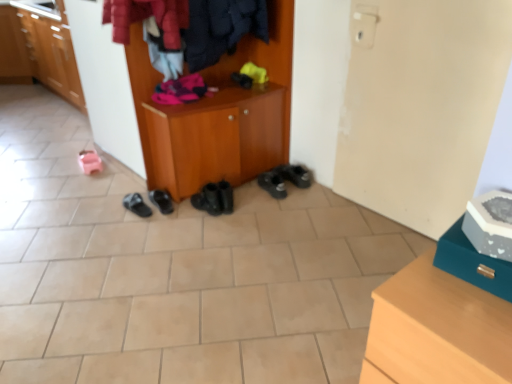
In order to click on empty space that is ontop of teak wood chest of drawers at lower right (from a real-world perspective) in this screenshot , I will do `click(465, 305)`.